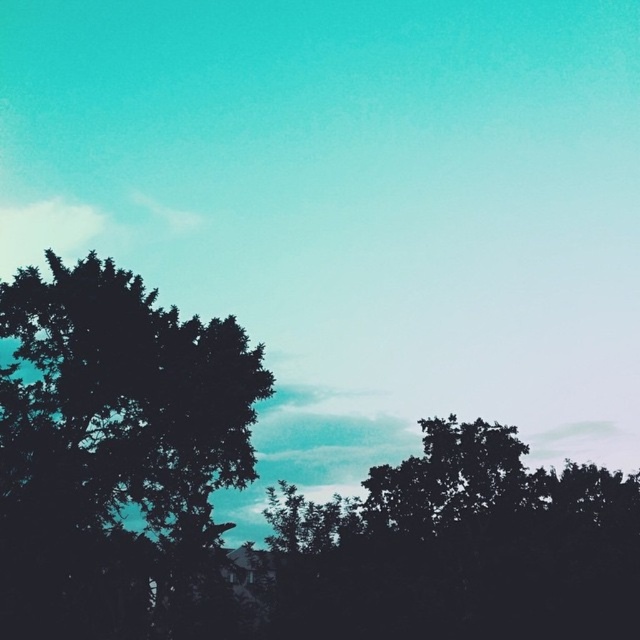
Describe the element at coordinates (112, 448) in the screenshot. I see `dark green leafy tree at left` at that location.

Is point (84, 321) more distant than point (454, 625)?

Yes.

What are the coordinates of `dark green leafy tree at left` in the screenshot? It's located at (112, 448).